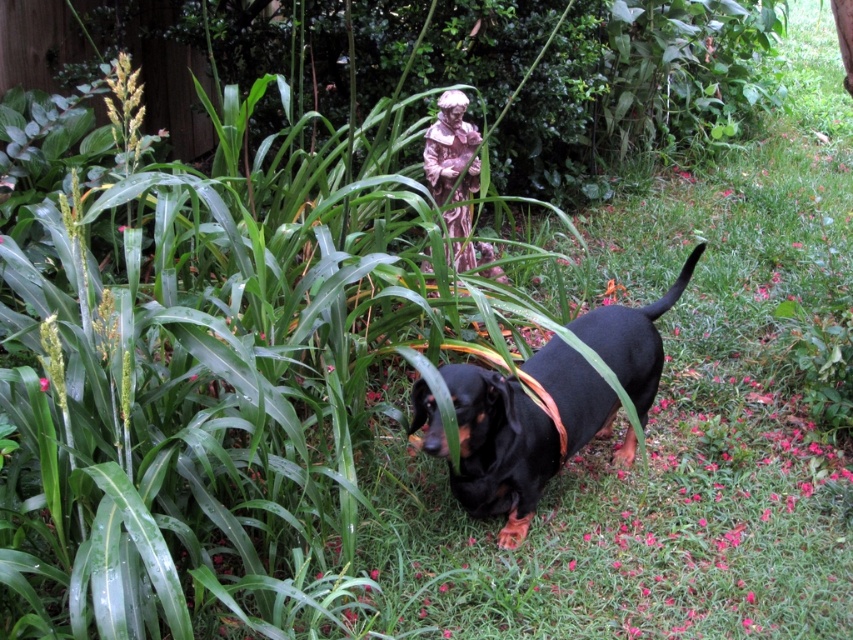
Question: Which object is farther from the camera taking this photo?

Choices:
 (A) pink ceramic statue at upper center
 (B) black matte dog at center

Answer: (A)

Question: Does black matte dog at center lie in front of pink ceramic statue at upper center?

Choices:
 (A) yes
 (B) no

Answer: (A)

Question: Among these points, which one is nearest to the camera?

Choices:
 (A) (505, 524)
 (B) (467, 248)

Answer: (A)

Question: Is black matte dog at center to the left of pink ceramic statue at upper center from the viewer's perspective?

Choices:
 (A) no
 (B) yes

Answer: (A)

Question: Among these points, which one is farthest from the camera?

Choices:
 (A) (666, 304)
 (B) (473, 125)

Answer: (B)

Question: Does black matte dog at center appear on the left side of pink ceramic statue at upper center?

Choices:
 (A) yes
 (B) no

Answer: (B)